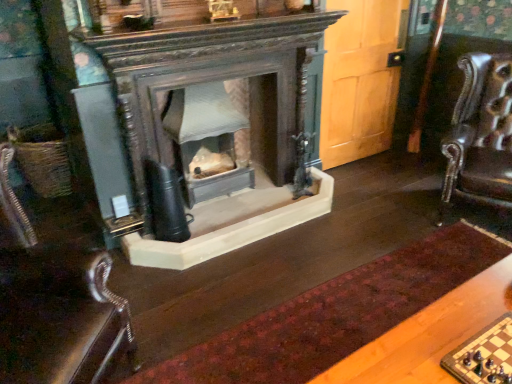
Question: In the image, is leather at left positioned in front of or behind wooden chessboard at lower right?

Choices:
 (A) front
 (B) behind

Answer: (A)

Question: From a real-world perspective, is leather at left physically located above or below wooden chessboard at lower right?

Choices:
 (A) above
 (B) below

Answer: (B)

Question: Which is nearer to the leather swivel chair at right?

Choices:
 (A) leather at left
 (B) velvet burgundy rug at center
 (C) matte glass fireplace at center
 (D) wooden chessboard at lower right

Answer: (B)

Question: Based on their relative distances, which object is farther from the wooden chessboard at lower right?

Choices:
 (A) matte glass fireplace at center
 (B) leather at left
 (C) leather swivel chair at right
 (D) velvet burgundy rug at center

Answer: (A)